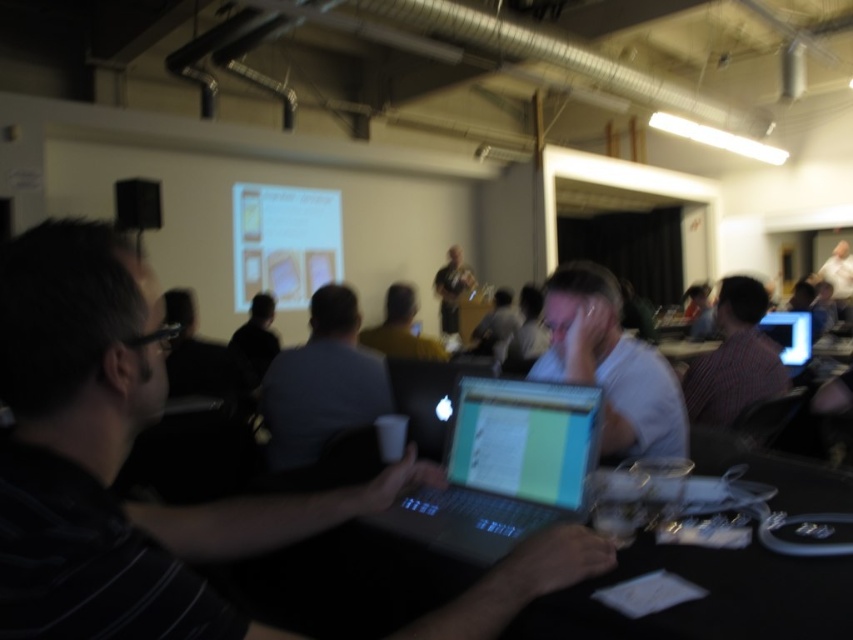
Between point (561, 461) and point (743, 296), which one is positioned behind?

Point (743, 296)

Is point (497, 460) less distant than point (766, 364)?

Yes.

Find the location of a particular element. This screenshot has width=853, height=640. matte plastic laptop at center is located at coordinates (525, 440).

What do you see at coordinates (399, 328) in the screenshot?
I see `yellow matte shirt at center` at bounding box center [399, 328].

Who is lower down, yellow matte shirt at center or matte gray shirt at center?

yellow matte shirt at center is lower down.

The width and height of the screenshot is (853, 640). Describe the element at coordinates (399, 328) in the screenshot. I see `yellow matte shirt at center` at that location.

Locate an element on the screen. The width and height of the screenshot is (853, 640). yellow matte shirt at center is located at coordinates (399, 328).

Looking at this image, who is positioned more to the left, black matte laptop at center or black matte shirt at center?

From the viewer's perspective, black matte shirt at center appears more on the left side.

Is black matte laptop at center to the right of black matte shirt at center from the viewer's perspective?

Correct, you'll find black matte laptop at center to the right of black matte shirt at center.

Where is `black matte laptop at center`? black matte laptop at center is located at coordinates (117, 458).

This screenshot has height=640, width=853. Find the location of `black matte laptop at center`. black matte laptop at center is located at coordinates (117, 458).